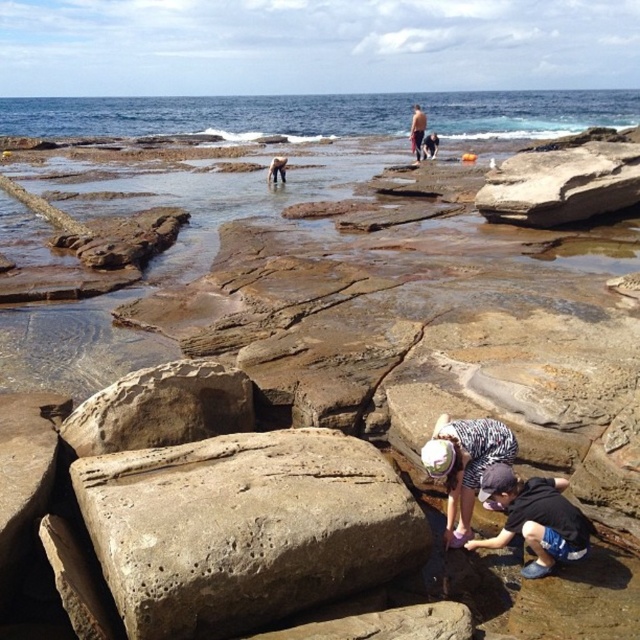
Is gray rough stone at center taller than blue water at upper center?

Incorrect, gray rough stone at center's height is not larger of blue water at upper center's.

You are a GUI agent. You are given a task and a screenshot of the screen. Output one action in this format:
    pyautogui.click(x=<x>, y=<y>)
    Task: Click on the gray rough stone at center
    This screenshot has width=640, height=640.
    Given the screenshot: What is the action you would take?
    pyautogui.click(x=244, y=529)

In order to click on gray rough stone at center in this screenshot , I will do `click(244, 529)`.

This screenshot has height=640, width=640. What do you see at coordinates (564, 179) in the screenshot?
I see `brown rough rock at center` at bounding box center [564, 179].

Consider the image. Between brown rough rock at center and dark blue shorts at center, which one appears on the right side from the viewer's perspective?

From the viewer's perspective, brown rough rock at center appears more on the right side.

Is point (598, 193) less distant than point (422, 125)?

Yes, point (598, 193) is closer to viewer.

The height and width of the screenshot is (640, 640). Find the location of `brown rough rock at center`. brown rough rock at center is located at coordinates (564, 179).

Is blue water at upper center wider than brown rough rock at center?

Yes, blue water at upper center is wider than brown rough rock at center.

Who is positioned more to the right, blue water at upper center or brown rough rock at center?

From the viewer's perspective, brown rough rock at center appears more on the right side.

Which is behind, point (628, 100) or point (561, 184)?

The point (628, 100) is behind.

Image resolution: width=640 pixels, height=640 pixels. I want to click on blue water at upper center, so click(x=324, y=115).